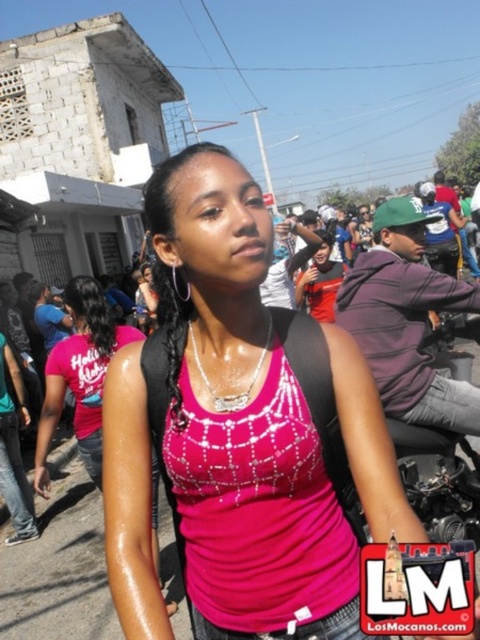
Can you confirm if purple fleece jacket at center is positioned below matte red shirt at center?

Yes, purple fleece jacket at center is below matte red shirt at center.

Is purple fleece jacket at center shorter than matte red shirt at center?

Incorrect, purple fleece jacket at center's height does not fall short of matte red shirt at center's.

What are the coordinates of `purple fleece jacket at center` in the screenshot? It's located at (407, 321).

Is point (324, 324) less distant than point (374, 276)?

Yes.

How much distance is there between pink fabric tank top at center and purple fleece jacket at center?

pink fabric tank top at center and purple fleece jacket at center are 36.89 inches apart from each other.

Find the location of `pink fabric tank top at center`. pink fabric tank top at center is located at coordinates (240, 420).

Where is `pink fabric tank top at center`? This screenshot has width=480, height=640. pink fabric tank top at center is located at coordinates (240, 420).

Is pink fabric tank top at center below matte red shirt at center?

Correct, pink fabric tank top at center is located below matte red shirt at center.

Find the location of a particular element. The image size is (480, 640). pink fabric tank top at center is located at coordinates (240, 420).